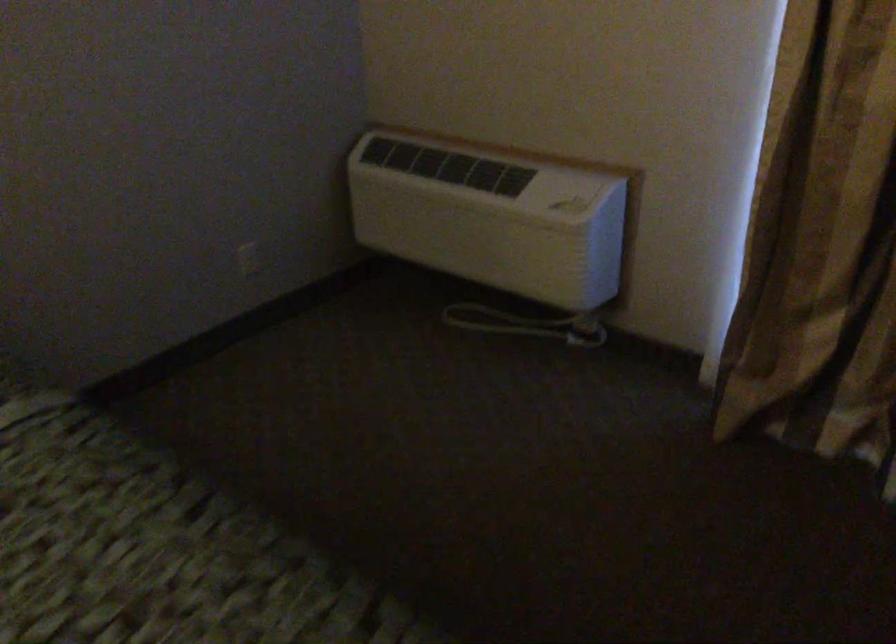
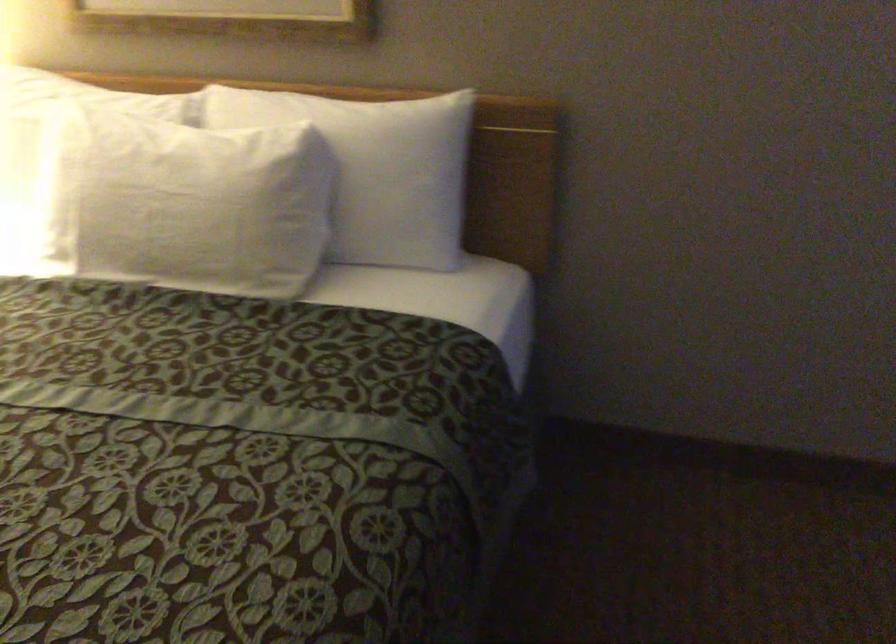
The first image is from the beginning of the video and the second image is from the end. How did the camera likely rotate when shooting the video?

The camera's rotation is toward left-down.